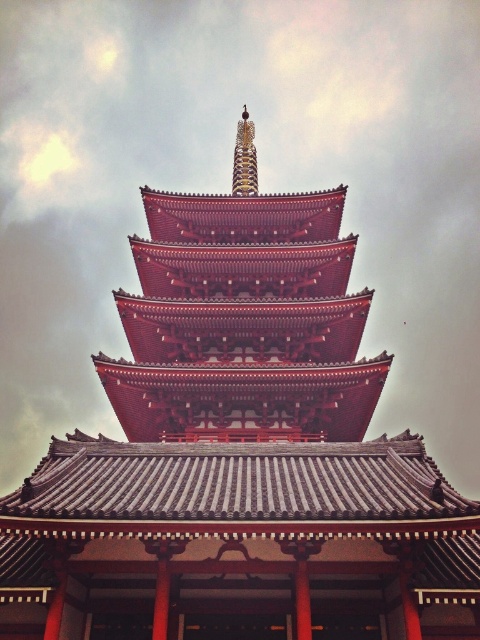
Question: Is shiny red pagoda at center in front of gold textured spire at upper center?

Choices:
 (A) yes
 (B) no

Answer: (A)

Question: Is shiny red pagoda at center wider than gold textured spire at upper center?

Choices:
 (A) no
 (B) yes

Answer: (B)

Question: Which point is closer to the camera?

Choices:
 (A) shiny red pagoda at center
 (B) gold textured spire at upper center

Answer: (A)

Question: Does shiny red pagoda at center appear over gold textured spire at upper center?

Choices:
 (A) no
 (B) yes

Answer: (A)

Question: Which object appears closest to the camera in this image?

Choices:
 (A) gold textured spire at upper center
 (B) shiny red pagoda at center

Answer: (B)